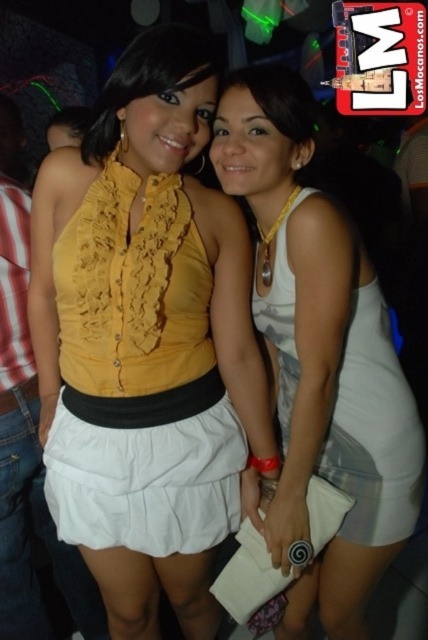
Between white satin dress at right and matte yellow blouse at center, which one is positioned lower?

white satin dress at right is lower down.

Which is behind, point (347, 388) or point (216, 70)?

Positioned behind is point (347, 388).

You are a GUI agent. You are given a task and a screenshot of the screen. Output one action in this format:
    pyautogui.click(x=<x>, y=<y>)
    Task: Click on the white satin dress at right
    
    Given the screenshot: What is the action you would take?
    pyautogui.click(x=374, y=429)

Which of these two, white cotton skirt at center or white satin dress at right, stands taller?

white satin dress at right

Image resolution: width=428 pixels, height=640 pixels. In order to click on white cotton skirt at center in this screenshot , I will do `click(145, 481)`.

Image resolution: width=428 pixels, height=640 pixels. Identify the location of white cotton skirt at center. (145, 481).

Looking at this image, which is above, yellow ruffled blouse at center or white cotton skirt at center?

yellow ruffled blouse at center

Describe the element at coordinates (145, 259) in the screenshot. I see `yellow ruffled blouse at center` at that location.

Identify the location of yellow ruffled blouse at center. [x=145, y=259].